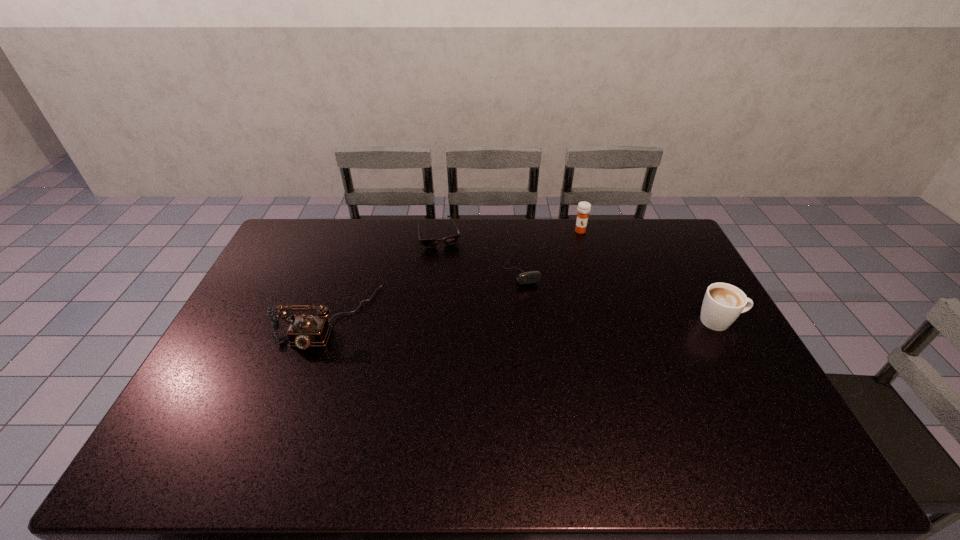
Where is `free space that satisfies the following two spatial constraints: 1. on the front side of the cappuccino; 2. with the handle on the side of the third object from left to right`? This screenshot has height=540, width=960. free space that satisfies the following two spatial constraints: 1. on the front side of the cappuccino; 2. with the handle on the side of the third object from left to right is located at coordinates (527, 321).

Identify the location of vacant point that satisfies the following two spatial constraints: 1. on the front side of the cappuccino; 2. with the handle on the side of the second object from right to left. (607, 321).

At what (x,y) coordinates should I click in order to perform the action: click on vacant space that satisfies the following two spatial constraints: 1. on the dial of the telephone; 2. with the handle on the side of the cappuccino. Please return your answer as a coordinate pair (x, y). Looking at the image, I should click on (327, 321).

You are a GUI agent. You are given a task and a screenshot of the screen. Output one action in this format:
    pyautogui.click(x=<x>, y=<y>)
    Task: Click on the vacant space that satisfies the following two spatial constraints: 1. on the front side of the rightmost object; 2. with the handle on the side of the shortest object
    The width and height of the screenshot is (960, 540).
    Given the screenshot: What is the action you would take?
    pyautogui.click(x=429, y=321)